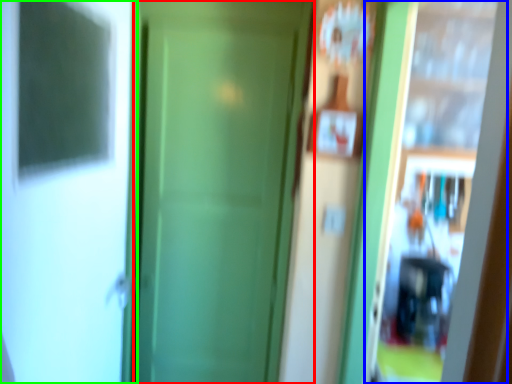
Question: Estimate the real-world distances between objects in this image. Which object is farther from door (highlighted by a red box), screen door (highlighted by a blue box) or screen door (highlighted by a green box)?

Choices:
 (A) screen door
 (B) screen door

Answer: (A)